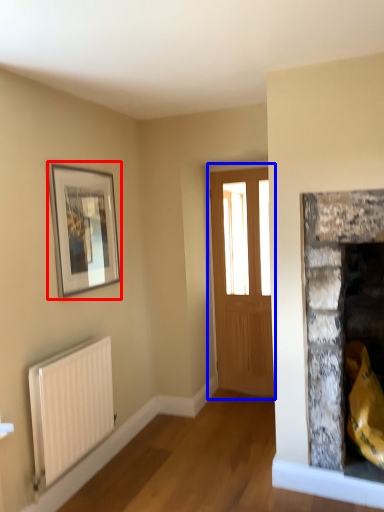
Question: Which point is further to the camera, picture frame (highlighted by a red box) or window (highlighted by a blue box)?

Choices:
 (A) picture frame
 (B) window

Answer: (B)